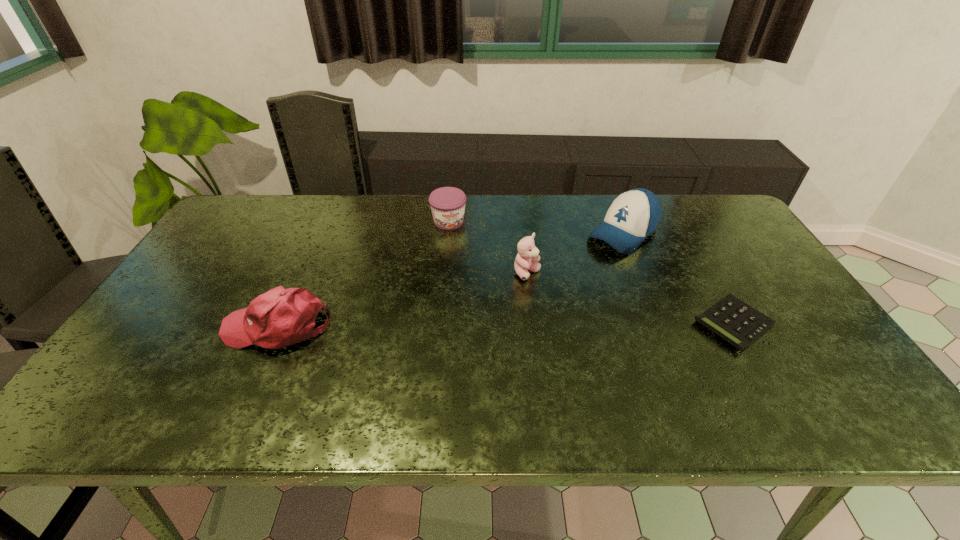
What are the coordinates of `free location located 0.310m on the front-facing side of the right baseball cap` in the screenshot? It's located at (538, 302).

Image resolution: width=960 pixels, height=540 pixels. Identify the location of jam positioned at the far edge. (447, 204).

This screenshot has width=960, height=540. I want to click on baseball cap at the far edge, so click(x=633, y=215).

Find the location of a particular element. The height and width of the screenshot is (540, 960). baseball cap located in the near edge section of the desktop is located at coordinates (281, 317).

Locate an element on the screen. This screenshot has height=540, width=960. calculator located at the near edge is located at coordinates (738, 323).

In order to click on object present at the right edge in this screenshot , I will do `click(738, 323)`.

Find the location of a particular element. Image resolution: width=960 pixels, height=540 pixels. object positioned at the near right corner is located at coordinates (738, 323).

This screenshot has height=540, width=960. I want to click on free space at the far edge of the desktop, so click(x=549, y=219).

In the image, there is a desktop. Where is `free space at the near edge`? free space at the near edge is located at coordinates (618, 382).

Find the location of a particular element. vacant region at the left edge of the desktop is located at coordinates (209, 297).